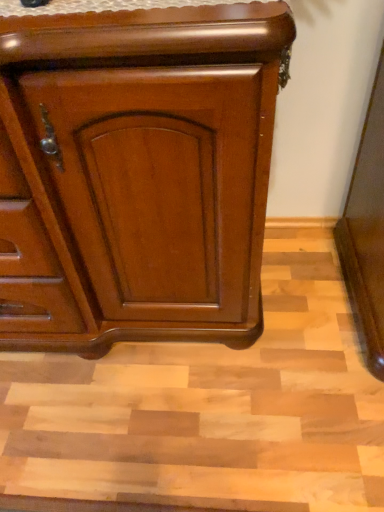
Identify the location of glossy wood chest of drawers at center. [x=136, y=174].

Describe the element at coordinates (136, 174) in the screenshot. I see `glossy wood chest of drawers at center` at that location.

What is the approximate width of glossy wood chest of drawers at center?

The width of glossy wood chest of drawers at center is 24.66 inches.

Find the location of a particular element. glossy wood chest of drawers at center is located at coordinates (136, 174).